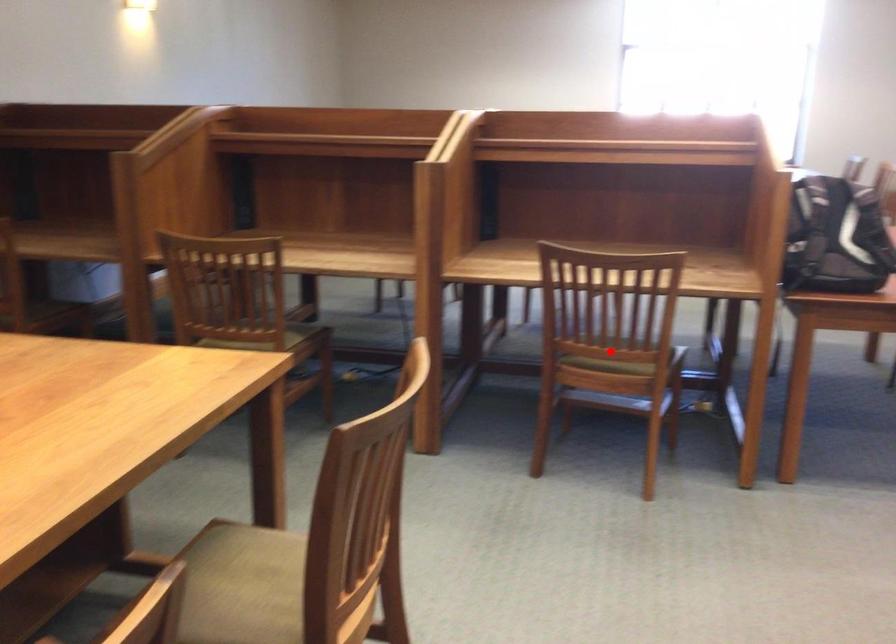
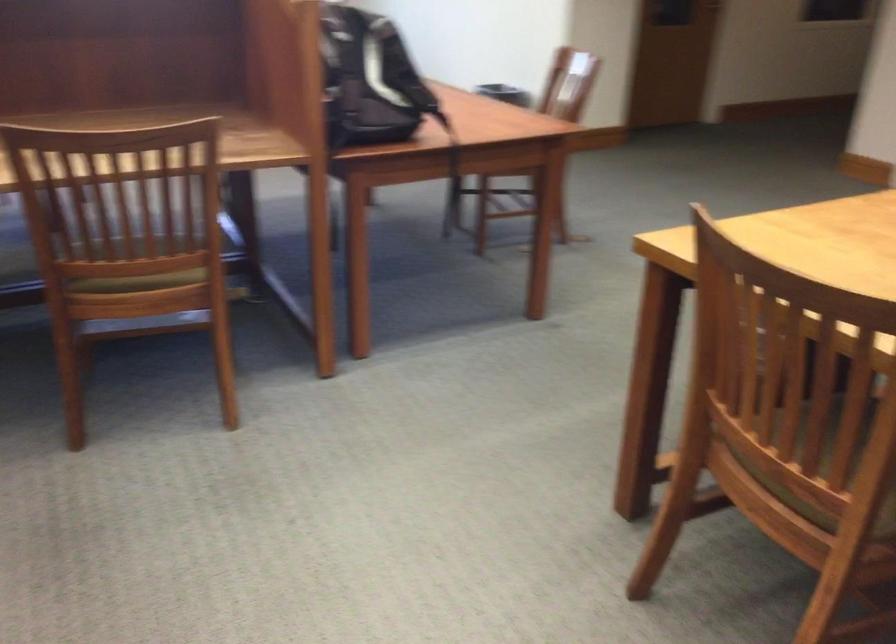
The point at the highlighted location is marked in the first image. Where is the corresponding point in the second image?

(139, 266)